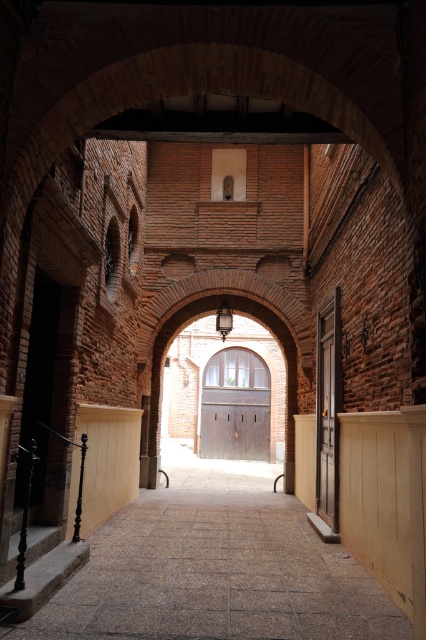
Question: Which point is closer to the camera?

Choices:
 (A) (344, 593)
 (B) (230, 433)

Answer: (A)

Question: Is smooth stone path at center bigger than brick archway at center?

Choices:
 (A) yes
 (B) no

Answer: (B)

Question: Can you confirm if brick archway at center is positioned to the left of brown wooden door at center?

Choices:
 (A) no
 (B) yes

Answer: (B)

Question: Which point is farther to the camera?

Choices:
 (A) brown wooden door at center
 (B) wooden door at center
 (C) brick archway at center
 (D) smooth stone path at center

Answer: (A)

Question: Is smooth stone path at center to the left of wooden door at center from the viewer's perspective?

Choices:
 (A) yes
 (B) no

Answer: (A)

Question: Which point appears farthest from the camera in this image?

Choices:
 (A) (215, 509)
 (B) (331, 374)
 (C) (261, 352)
 (D) (207, 448)

Answer: (C)